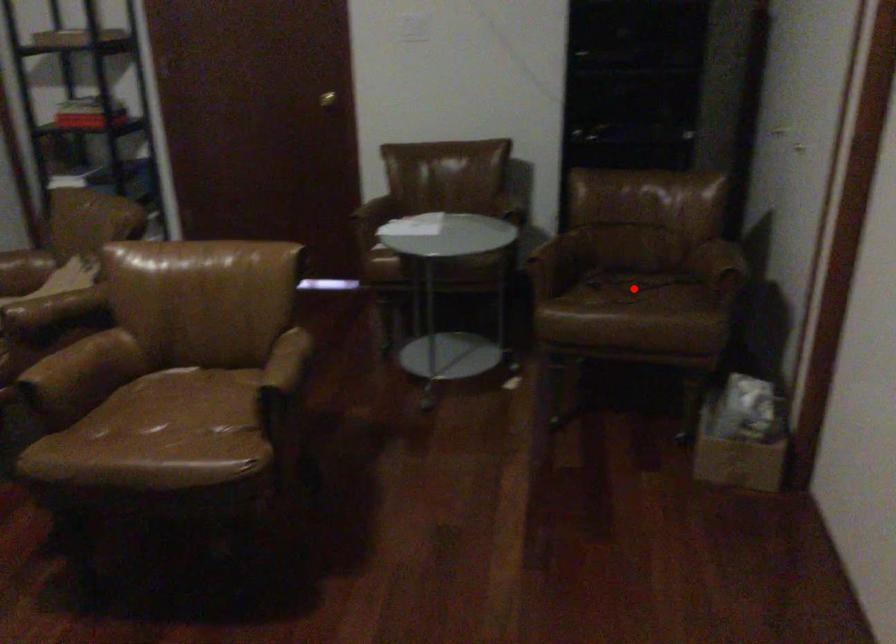
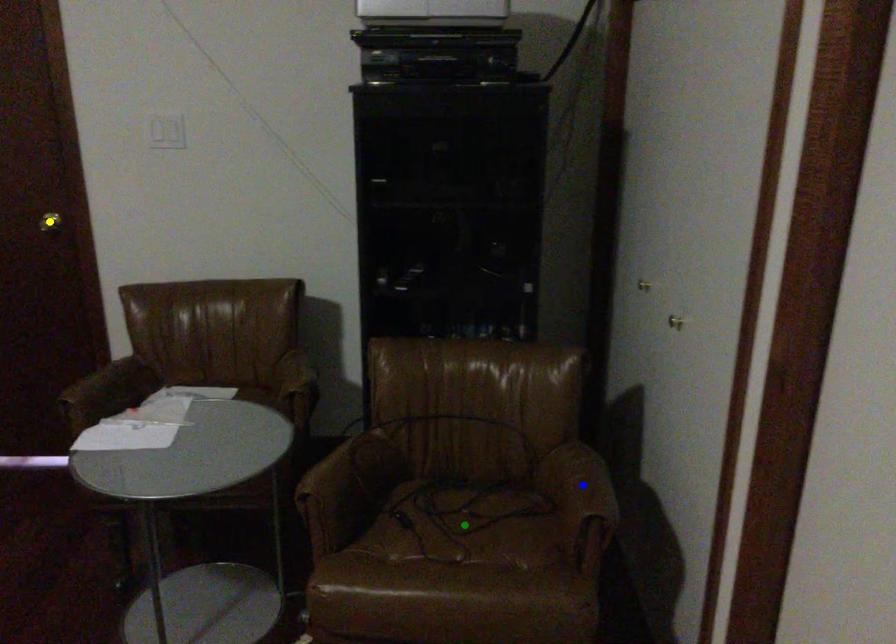
Question: I am providing you with two images of the same scene from different viewpoints. A red point is marked on the first image. You are given multiple points on the second image. Which point in image 2 represents the same 3d spot as the red point in image 1?

Choices:
 (A) green point
 (B) yellow point
 (C) blue point

Answer: (A)